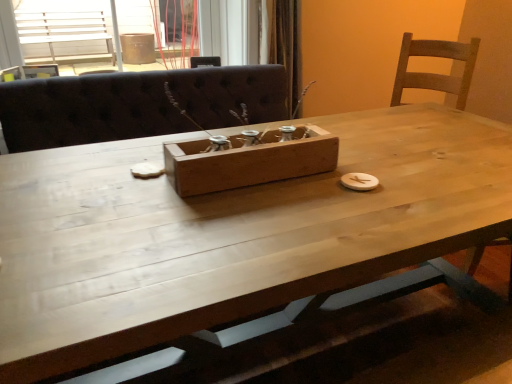
This screenshot has width=512, height=384. I want to click on vacant area that lies in front of wooden box at center, so click(x=250, y=226).